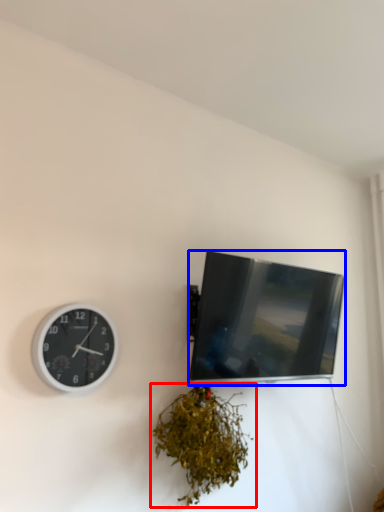
Question: Which point is further to the camera, houseplant (highlighted by a red box) or television (highlighted by a blue box)?

Choices:
 (A) houseplant
 (B) television

Answer: (B)